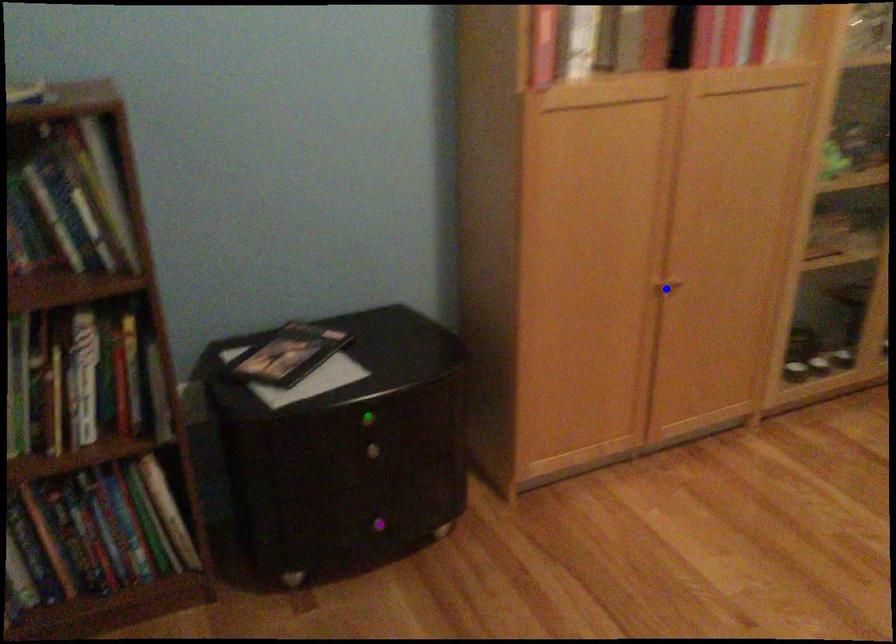
Order these from nearest to farthest:
blue point, green point, purple point

green point
purple point
blue point